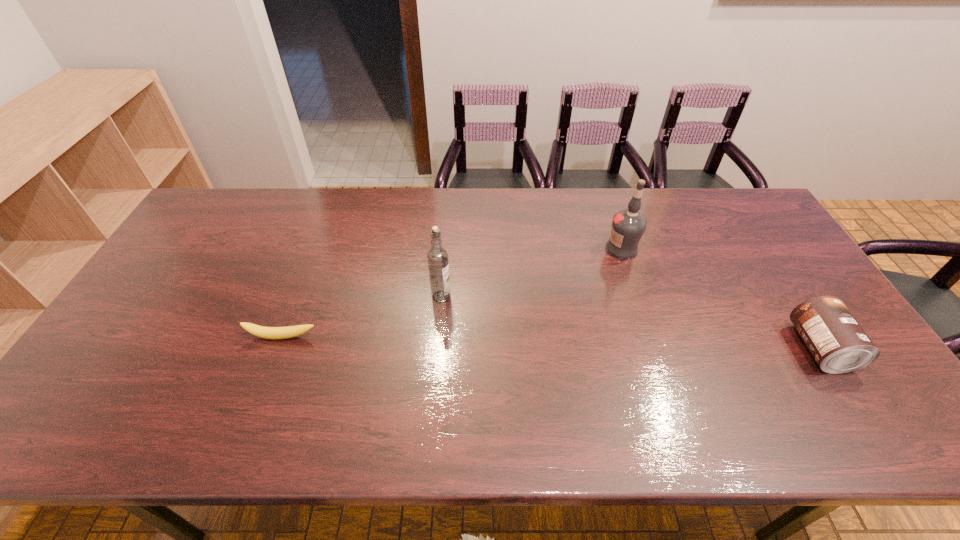
Identify the location of the shortest object. This screenshot has width=960, height=540. (291, 331).

Where is `banana`? This screenshot has width=960, height=540. banana is located at coordinates (291, 331).

The image size is (960, 540). Identify the location of can. (838, 343).

This screenshot has height=540, width=960. I want to click on the second shortest object, so click(x=838, y=343).

The image size is (960, 540). I want to click on the farther vodka, so click(x=628, y=225).

Find the location of a particular element. The image size is (960, 540). the third object from left to right is located at coordinates 628,225.

Locate an element on the screen. The width and height of the screenshot is (960, 540). the nearer vodka is located at coordinates 437,257.

Image resolution: width=960 pixels, height=540 pixels. Identify the location of the left vodka. (437, 257).

At what (x,y) coordinates should I click in order to perform the action: click on vacant space located on the upward curve of the banana. Please return your answer as a coordinate pair (x, y). This screenshot has height=540, width=960. Looking at the image, I should click on (264, 386).

The image size is (960, 540). I want to click on vacant area located 0.400m on the front label of the farther vodka, so click(x=516, y=320).